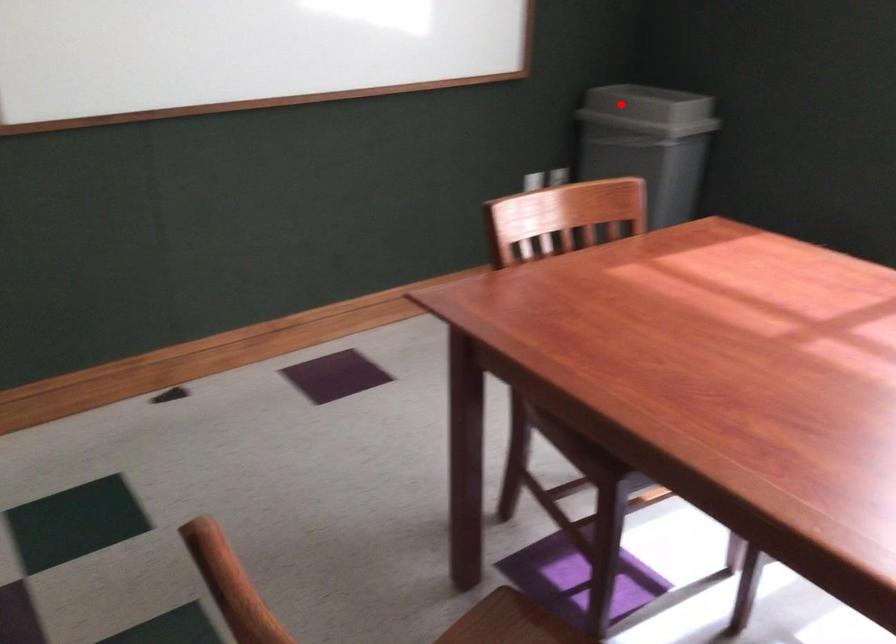
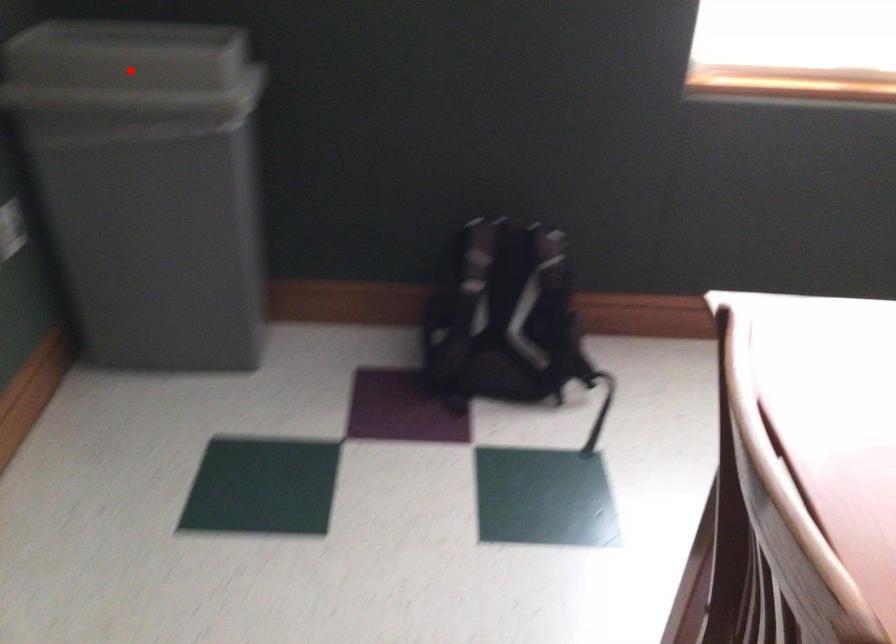
I am providing you with two images of the same scene from different viewpoints. A red point is marked on the first image and another point is marked on the second image. Is the red point in image1 aligned with the point shown in image2?

Yes